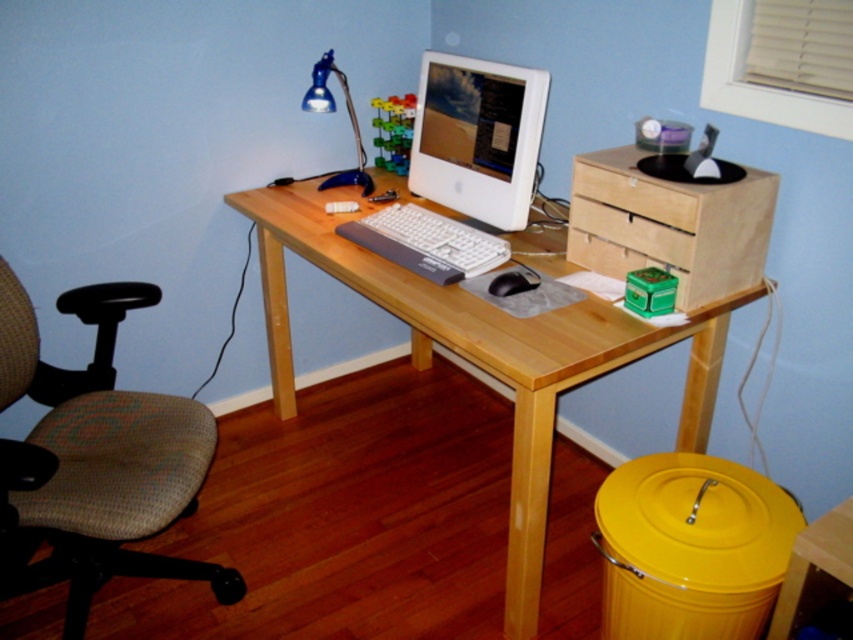
Question: Is birch wood drawer at right to the right of black matte mouse at center from the viewer's perspective?

Choices:
 (A) yes
 (B) no

Answer: (A)

Question: Is beige fabric swivel chair at left further to the viewer compared to black matte mouse at center?

Choices:
 (A) yes
 (B) no

Answer: (B)

Question: Which is nearer to the white glossy computer monitor at upper center?

Choices:
 (A) natural wood computer desk at center
 (B) blue plastic desk lamp at upper left
 (C) black matte mouse at center

Answer: (A)

Question: Which object is farther from the camera taking this photo?

Choices:
 (A) beige fabric swivel chair at left
 (B) birch wood drawer at right

Answer: (B)

Question: Which point is farther to the camera?

Choices:
 (A) natural wood computer desk at center
 (B) birch wood drawer at right
 (C) black matte mouse at center
 (D) white glossy computer monitor at upper center

Answer: (D)

Question: Does natural wood computer desk at center come behind birch wood drawer at right?

Choices:
 (A) yes
 (B) no

Answer: (B)